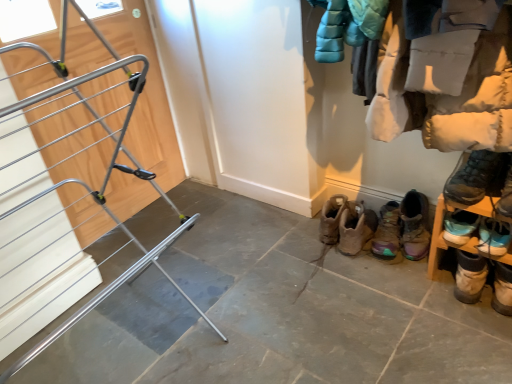
This screenshot has height=384, width=512. In order to click on free space between silver metallic drying rack at left and camouflage fabric boot at lower center, which is counted as the 5th footwear, starting from the right in this screenshot , I will do `click(271, 298)`.